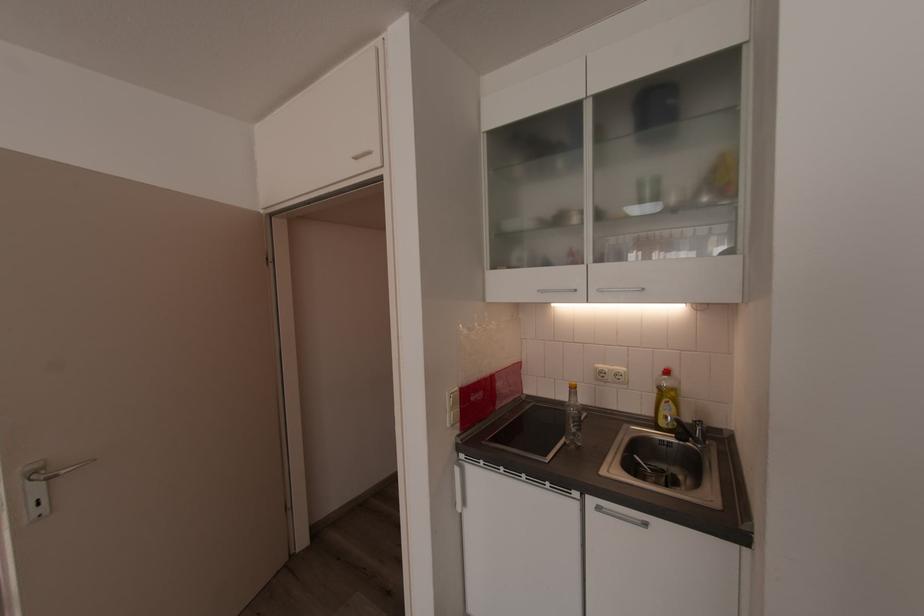
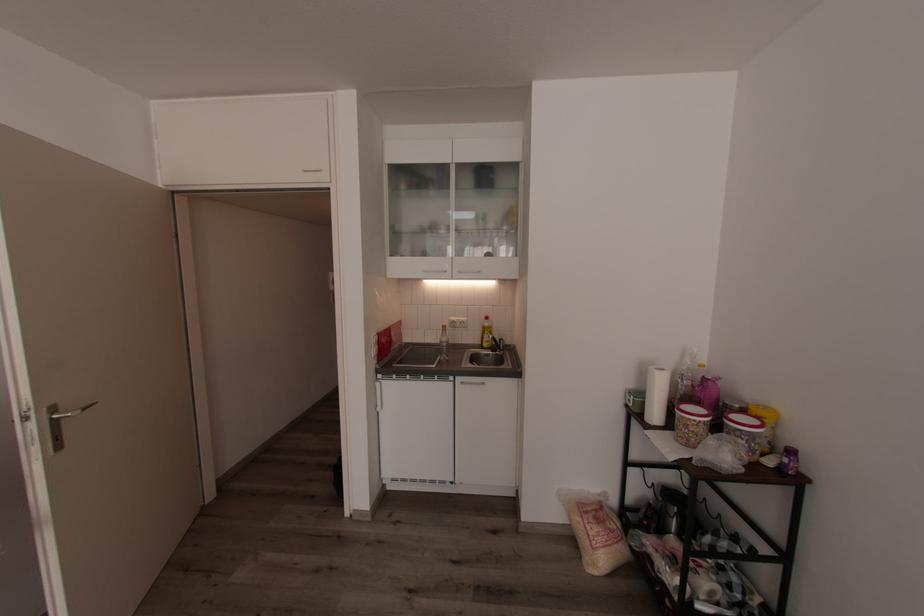
Locate, in the second image, the point that corresponds to (552,302) in the first image.

(423, 280)